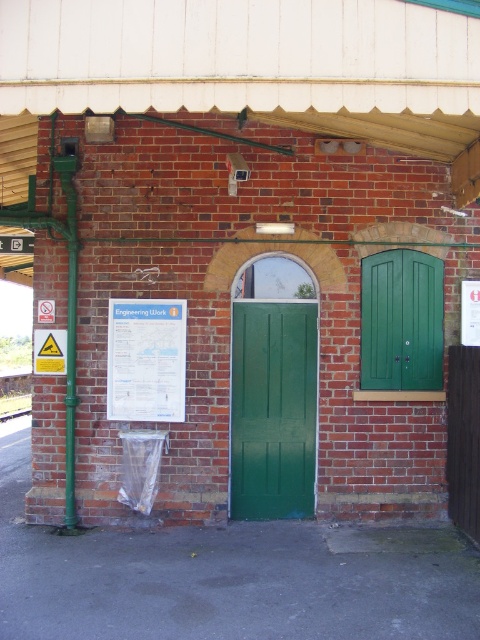
Question: Does brushed metal sign at upper left appear on the left side of metal train track at lower left?

Choices:
 (A) no
 (B) yes

Answer: (A)

Question: Which of the following is the closest to the observer?

Choices:
 (A) green wooden door at right
 (B) green matte door at center
 (C) metal train track at lower left

Answer: (A)

Question: Which point is farther from the camera taking this photo?

Choices:
 (A) (24, 408)
 (B) (309, 497)
 (C) (19, 250)
 (D) (417, 321)

Answer: (A)

Question: Is green matte door at center smaller than metal train track at lower left?

Choices:
 (A) no
 (B) yes

Answer: (A)

Question: Which of the following is the farthest from the observer?

Choices:
 (A) (290, 308)
 (B) (408, 381)

Answer: (A)

Question: Does green matte door at center appear under green wooden door at right?

Choices:
 (A) no
 (B) yes

Answer: (B)